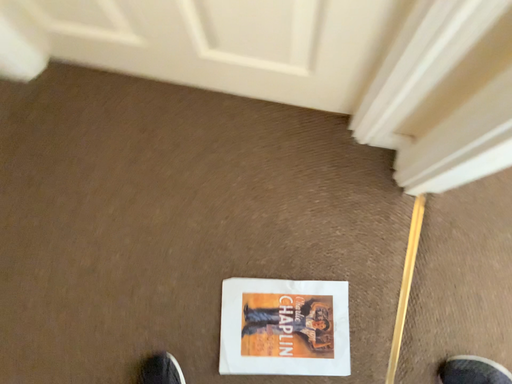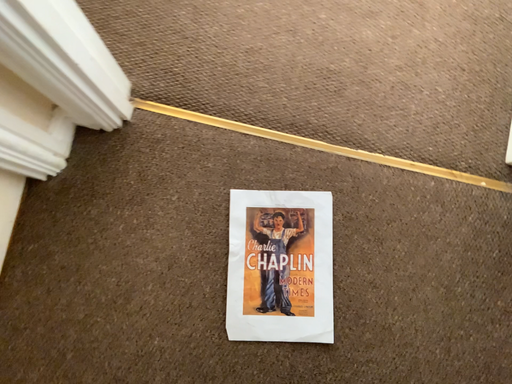
Question: Which way did the camera rotate in the video?

Choices:
 (A) rotated upward
 (B) rotated downward

Answer: (A)